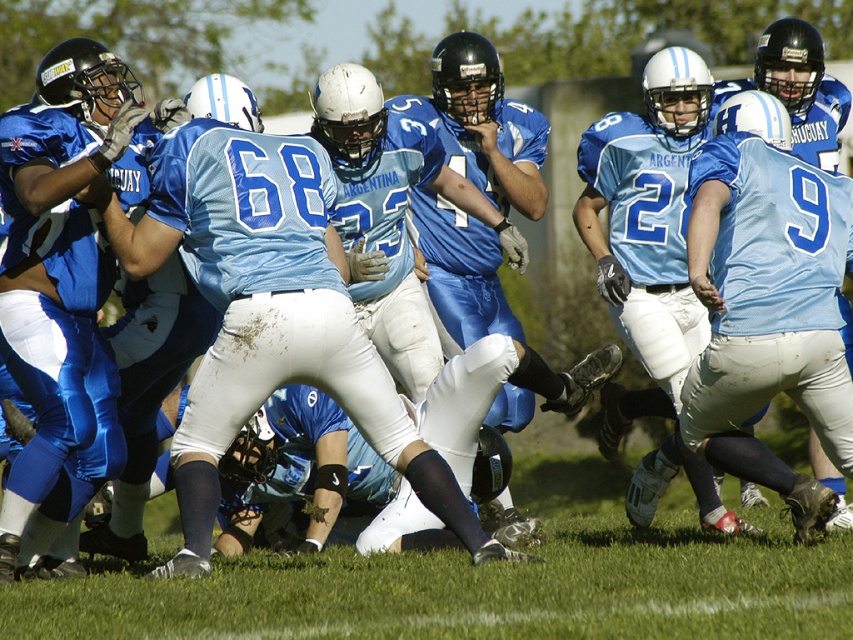
You are a sports analyst watching this football game. You notice two players wearing light blue fabric jersey at center and matte blue jersey at center. Which player is closer to the camera?

The light blue fabric jersey at center is closer to the camera because it is in front of the matte blue jersey at center.